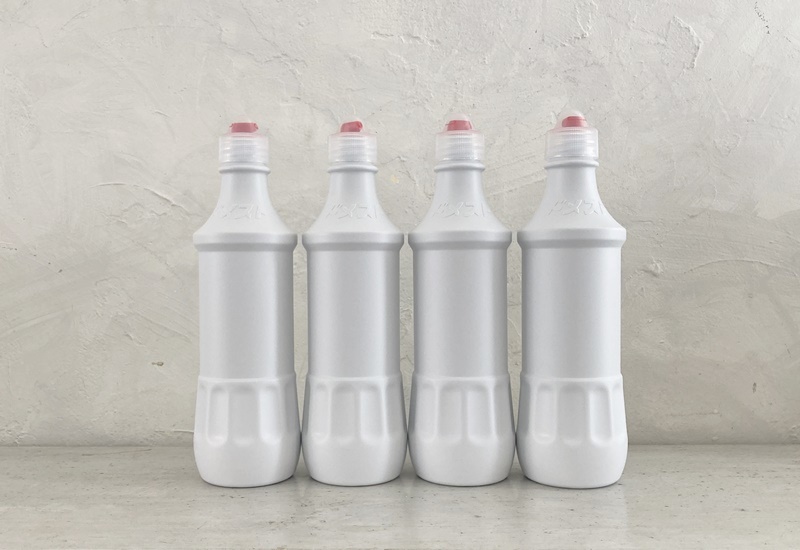
Image resolution: width=800 pixels, height=550 pixels. In order to click on white bottles next to a white wall in this screenshot , I will do `click(248, 396)`, `click(358, 371)`, `click(454, 337)`, `click(566, 297)`.